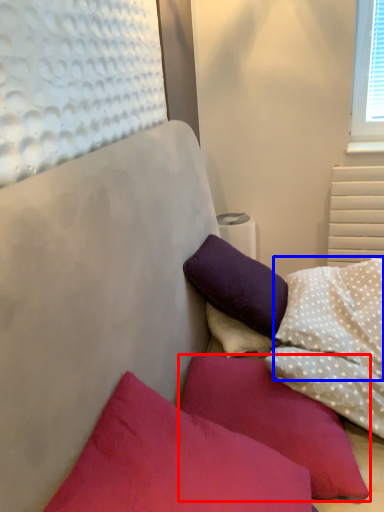
Question: Which object appears farthest to the camera in this image, pillow (highlighted by a red box) or pillow (highlighted by a blue box)?

Choices:
 (A) pillow
 (B) pillow

Answer: (B)